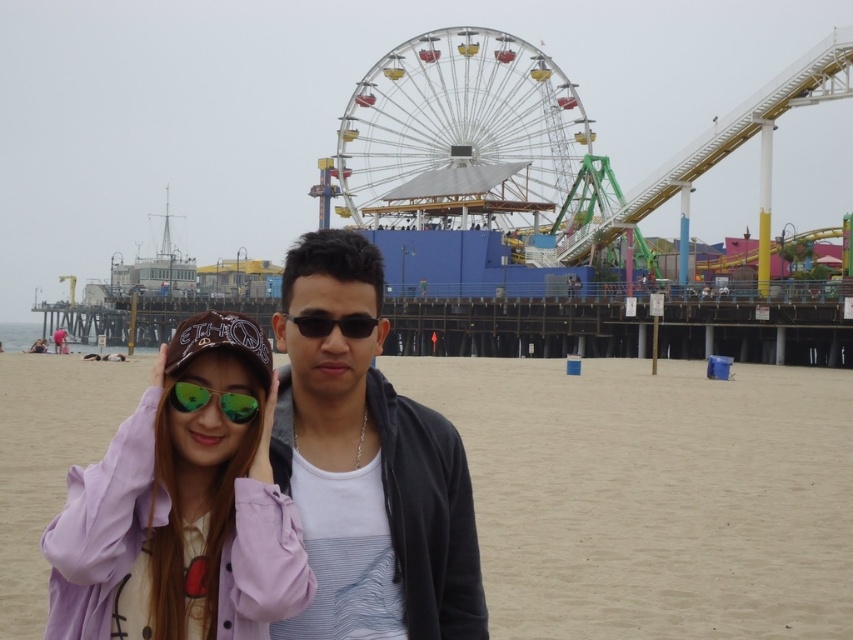
Does black matte jacket at center come behind black reflective sunglasses at center?

No, it is in front of black reflective sunglasses at center.

Between black matte jacket at center and black reflective sunglasses at center, which one has more height?

Standing taller between the two is black matte jacket at center.

Which is behind, point (412, 563) or point (297, 326)?

Point (297, 326)

The image size is (853, 640). Identify the location of black matte jacket at center. (367, 467).

You are a GUI agent. You are given a task and a screenshot of the screen. Output one action in this format:
    pyautogui.click(x=<x>, y=<y>)
    Task: Click on the beige sandy beach at lower center
    
    Given the screenshot: What is the action you would take?
    pyautogui.click(x=653, y=496)

The image size is (853, 640). Describe the element at coordinates (653, 496) in the screenshot. I see `beige sandy beach at lower center` at that location.

The image size is (853, 640). What are the coordinates of `beige sandy beach at lower center` in the screenshot? It's located at (653, 496).

Is metallic ferris wheel at upper center below green reflective sunglasses at center?

Incorrect, metallic ferris wheel at upper center is not positioned below green reflective sunglasses at center.

In the scene shown: Who is positioned more to the left, metallic ferris wheel at upper center or green reflective sunglasses at center?

Positioned to the left is green reflective sunglasses at center.

Describe the element at coordinates (457, 132) in the screenshot. This screenshot has height=640, width=853. I see `metallic ferris wheel at upper center` at that location.

Locate an element on the screen. The width and height of the screenshot is (853, 640). metallic ferris wheel at upper center is located at coordinates (457, 132).